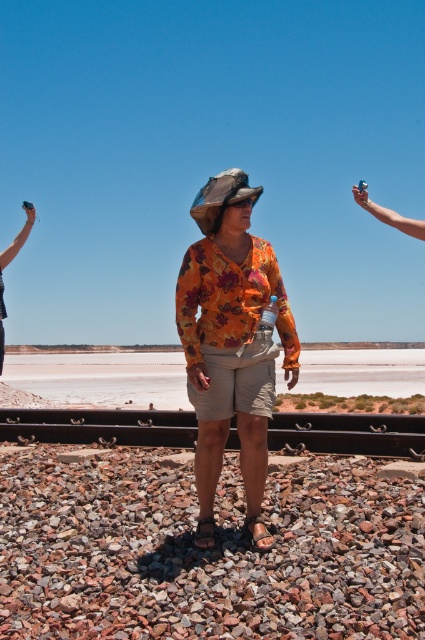
You are a photographer setting up a shot. You have a gray gravel at center and a metallic silver knife at left in the scene. Which object is taller when viewed from the photographer perspective?

The metallic silver knife at left is taller than the gray gravel at center.

You are a photographer planning to take a closeup shot of the floral fabric shirt at center and the metallic silver knife at left. Which object should you zoom in on to ensure both are in focus without moving the camera?

The floral fabric shirt at center has a smaller size compared to metallic silver knife at left, so you should zoom in on the smaller object, the floral fabric shirt at center, to ensure both are in focus without moving the camera.

You are a photographer trying to capture the person in the image. The person is standing at point (231, 342). Where should you position your camera to ensure the floral fabric shirt at center is in focus?

The floral fabric shirt at center is represented by point (231, 342), so you should position your camera to focus on that point to ensure the floral fabric shirt at center is in focus.